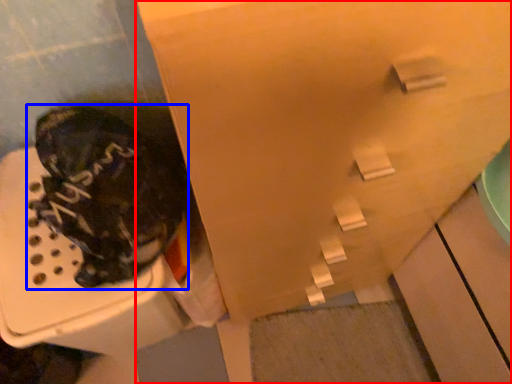
Question: Which object appears closest to the camera in this image, cabinetry (highlighted by a red box) or footwear (highlighted by a blue box)?

Choices:
 (A) cabinetry
 (B) footwear

Answer: (A)